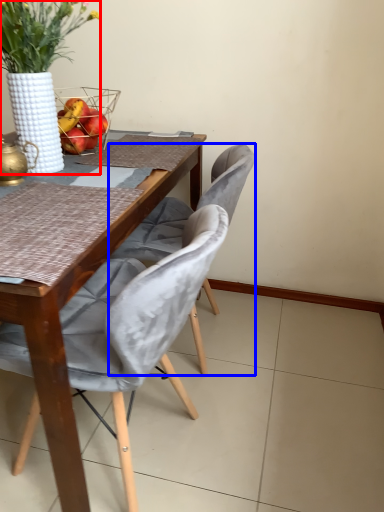
Question: Which object is closer to the camera taking this photo, houseplant (highlighted by a red box) or chair (highlighted by a blue box)?

Choices:
 (A) houseplant
 (B) chair

Answer: (A)